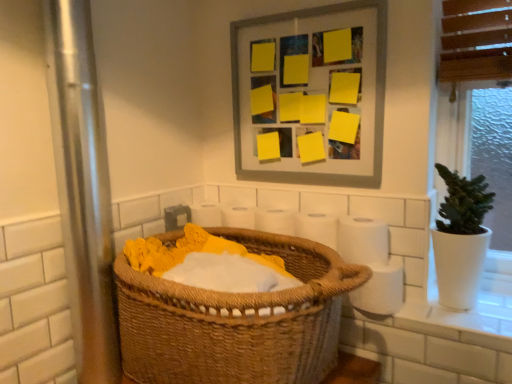
Question: From the image's perspective, is white matte toilet paper at right, the 2th toilet paper positioned from the bottom, over matte gray picture frame at upper center?

Choices:
 (A) yes
 (B) no

Answer: (B)

Question: Is white matte toilet paper at right, which is counted as the 2th toilet paper, starting from the top, to the right of matte gray picture frame at upper center from the viewer's perspective?

Choices:
 (A) no
 (B) yes

Answer: (B)

Question: Is white matte toilet paper at right, which is counted as the 2th toilet paper, starting from the top, smaller than matte gray picture frame at upper center?

Choices:
 (A) yes
 (B) no

Answer: (A)

Question: Is white matte toilet paper at right, which is counted as the 2th toilet paper, starting from the top, bigger than matte gray picture frame at upper center?

Choices:
 (A) no
 (B) yes

Answer: (A)

Question: Is white matte toilet paper at right, which is counted as the 2th toilet paper, starting from the top, taller than matte gray picture frame at upper center?

Choices:
 (A) yes
 (B) no

Answer: (B)

Question: Looking at their shapes, would you say white paper at center, which appears as the 1th toilet paper when viewed from the top, is wider or thinner than white matte toilet paper at right, which appears as the first toilet paper when ordered from the bottom?

Choices:
 (A) thin
 (B) wide

Answer: (A)

Question: Considering the positions of white paper at center, the 3th toilet paper positioned from the bottom, and white matte toilet paper at right, which appears as the first toilet paper when ordered from the bottom, in the image, is white paper at center, the 3th toilet paper positioned from the bottom, bigger or smaller than white matte toilet paper at right, which appears as the first toilet paper when ordered from the bottom,?

Choices:
 (A) small
 (B) big

Answer: (A)

Question: In the image, is white paper at center, the 3th toilet paper positioned from the bottom, positioned in front of or behind white matte toilet paper at right, which appears as the first toilet paper when ordered from the bottom?

Choices:
 (A) front
 (B) behind

Answer: (B)

Question: In the image, is white paper at center, which appears as the 1th toilet paper when viewed from the top, on the left side or the right side of white matte toilet paper at right, the 3th toilet paper in the top-to-bottom sequence?

Choices:
 (A) left
 (B) right

Answer: (A)

Question: Is white paper at center, which appears as the 1th toilet paper when viewed from the top, wider or thinner than woven brown basket at center?

Choices:
 (A) thin
 (B) wide

Answer: (A)

Question: Considering the positions of white paper at center, the 3th toilet paper positioned from the bottom, and woven brown basket at center in the image, is white paper at center, the 3th toilet paper positioned from the bottom, taller or shorter than woven brown basket at center?

Choices:
 (A) short
 (B) tall

Answer: (A)

Question: From the image's perspective, is white paper at center, which appears as the 1th toilet paper when viewed from the top, located above or below woven brown basket at center?

Choices:
 (A) below
 (B) above

Answer: (B)

Question: Is point (309, 215) positioned closer to the camera than point (298, 259)?

Choices:
 (A) farther
 (B) closer

Answer: (A)

Question: Considering the positions of white matte toilet paper at right, the 2th toilet paper positioned from the bottom, and white matte toilet paper at right, the 3th toilet paper in the top-to-bottom sequence, in the image, is white matte toilet paper at right, the 2th toilet paper positioned from the bottom, bigger or smaller than white matte toilet paper at right, the 3th toilet paper in the top-to-bottom sequence,?

Choices:
 (A) big
 (B) small

Answer: (B)

Question: Is white matte toilet paper at right, which is counted as the 2th toilet paper, starting from the top, wider or thinner than white matte toilet paper at right, the 3th toilet paper in the top-to-bottom sequence?

Choices:
 (A) wide
 (B) thin

Answer: (B)